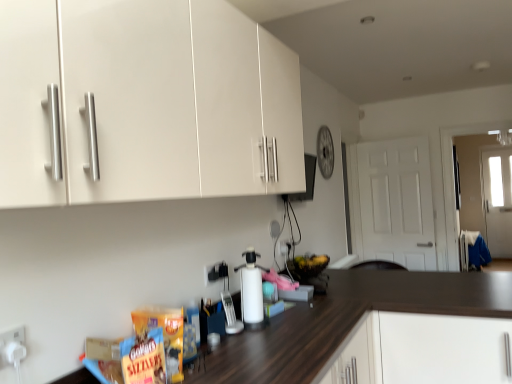
Question: From the image's perspective, is white plastic electric outlet at center, the 2th electric outlet when ordered from back to front, beneath white plastic electric outlet at lower left, placed as the 3th electric outlet when sorted from right to left?

Choices:
 (A) no
 (B) yes

Answer: (A)

Question: Can you confirm if white plastic electric outlet at center, the 2th electric outlet when ordered from front to back, is taller than white plastic electric outlet at lower left, positioned as the first electric outlet in front-to-back order?

Choices:
 (A) yes
 (B) no

Answer: (B)

Question: Does white plastic electric outlet at center, the 2th electric outlet when ordered from back to front, lie in front of white plastic electric outlet at lower left, positioned as the first electric outlet in front-to-back order?

Choices:
 (A) no
 (B) yes

Answer: (A)

Question: Is white plastic electric outlet at center, which appears as the 2th electric outlet when viewed from the right, shorter than white plastic electric outlet at lower left, positioned as the first electric outlet in left-to-right order?

Choices:
 (A) no
 (B) yes

Answer: (B)

Question: Are white plastic electric outlet at center, the 2th electric outlet when ordered from back to front, and white plastic electric outlet at lower left, positioned as the first electric outlet in front-to-back order, far apart?

Choices:
 (A) yes
 (B) no

Answer: (B)

Question: Would you say white plastic electric outlet at lower left, positioned as the first electric outlet in front-to-back order, is part of white plastic electric outlet at center, which appears as the 2th electric outlet when viewed from the right,'s contents?

Choices:
 (A) no
 (B) yes

Answer: (A)

Question: Can you confirm if white matte cabinet at lower right is taller than white matte door at right?

Choices:
 (A) no
 (B) yes

Answer: (A)

Question: Is the position of white matte cabinet at lower right more distant than that of white matte door at right?

Choices:
 (A) yes
 (B) no

Answer: (B)

Question: From the image's perspective, is white matte cabinet at lower right located above white matte door at right?

Choices:
 (A) no
 (B) yes

Answer: (A)

Question: Is white matte cabinet at lower right thinner than white matte door at right?

Choices:
 (A) no
 (B) yes

Answer: (A)

Question: Does white matte cabinet at lower right appear on the right side of white matte door at right?

Choices:
 (A) yes
 (B) no

Answer: (B)

Question: Could you tell me if white matte cabinet at lower right is facing white matte door at right?

Choices:
 (A) yes
 (B) no

Answer: (B)

Question: Are white matte door at right and white matte cabinet at lower right far apart?

Choices:
 (A) no
 (B) yes

Answer: (B)